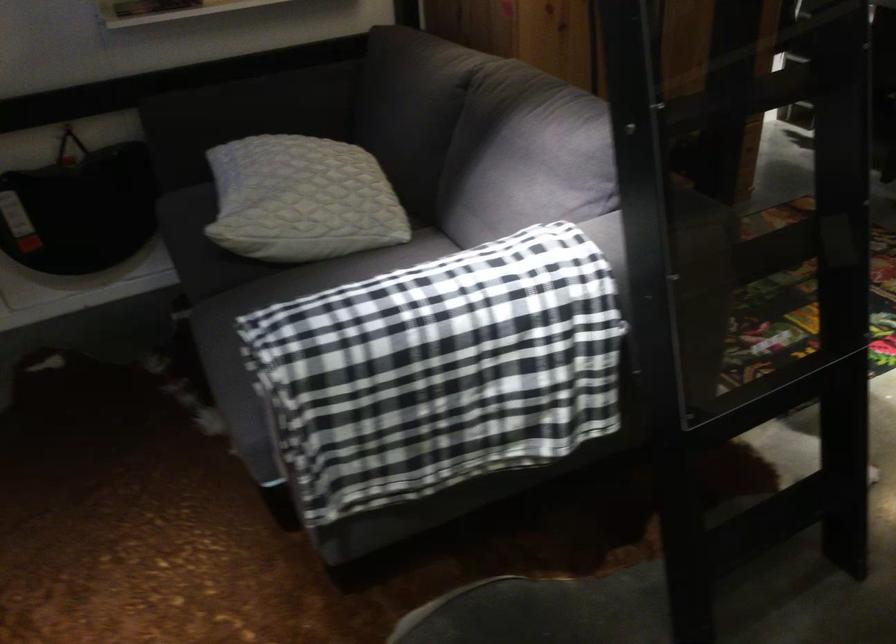
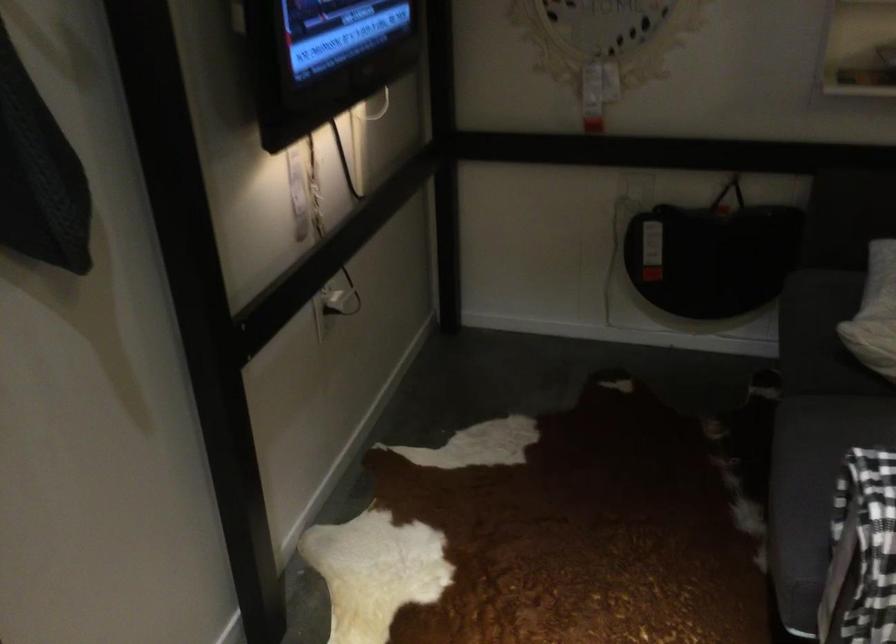
Locate, in the second image, the point that corresponds to (236,377) in the first image.

(805, 494)